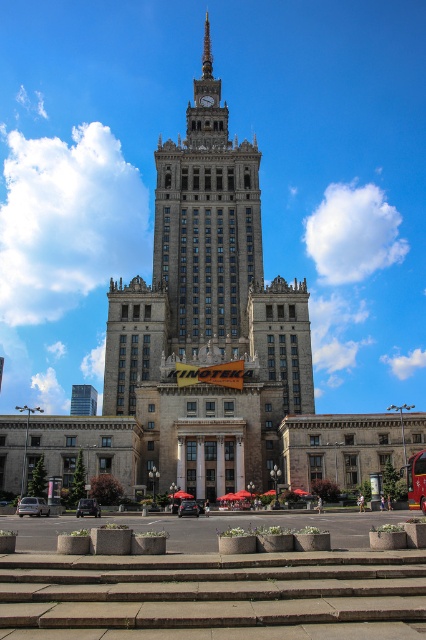
You are standing in front of the grand building and want to take a photo. You notice two points marked on your camera screen at coordinates point [222,179] and point [408,476]. Which point is closer to your camera lens?

Point [222,179] is further to the camera than point [408,476], so the point closer to the camera lens is point [408,476].

You are standing in the plaza in front of the building and want to approach the entrance. Which object should you walk towards first, the brown stone stairs at center or the stone clock tower at center?

You should walk towards the brown stone stairs at center first because they are positioned to the right of the stone clock tower at center, which suggests they lead to the entrance.

You are standing in front of the grand building and want to enter through the entrance. According to the image, where exactly are the brown stone stairs at center located?

The brown stone stairs at center are located at point (210, 589).